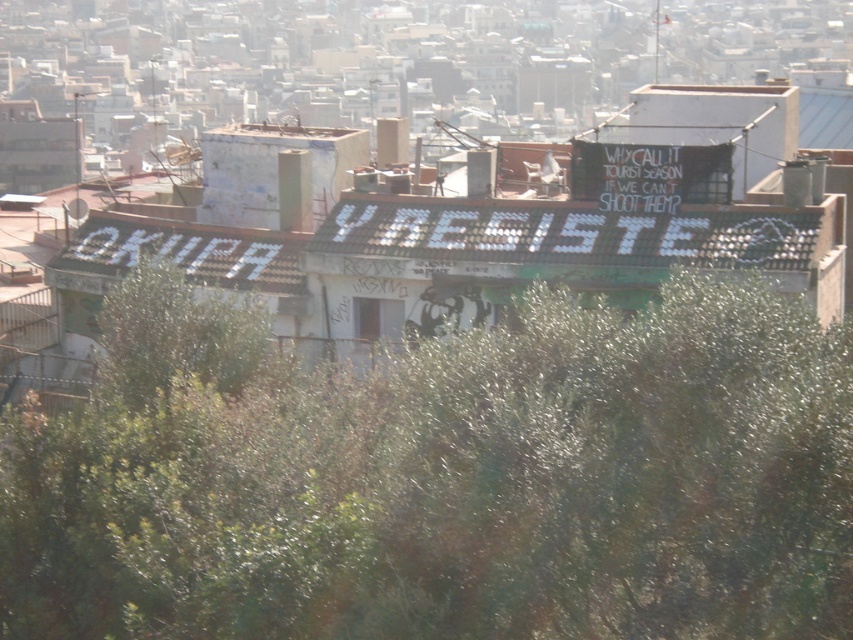
You are a city planner assessing rooftop space for a new garden. You notice a green leafy tree at center and a white tile roof at center. Which object takes up more horizontal space on the roof?

The white tile roof at center takes up more horizontal space than the green leafy tree at center because the green leafy tree at center has a lesser width compared to the white tile roof at center.

You are a bird looking for a place to perch. You see a green leafy tree at center and a white tile roof at center. Which location would provide better shelter from the rain?

The green leafy tree at center is positioned under white tile roof at center, so the white tile roof at center would provide better shelter from the rain as it is above the tree and can protect from rain more effectively.

You are standing on the rooftop and want to place a small potted plant. The potted plant requires a spot that is exactly at the center of the roof. According to the coordinates provided, is the point at (567, 232) suitable for placing the potted plant?

Yes, the point at (567, 232) is suitable because the white tile roof at center is located exactly at that coordinate.